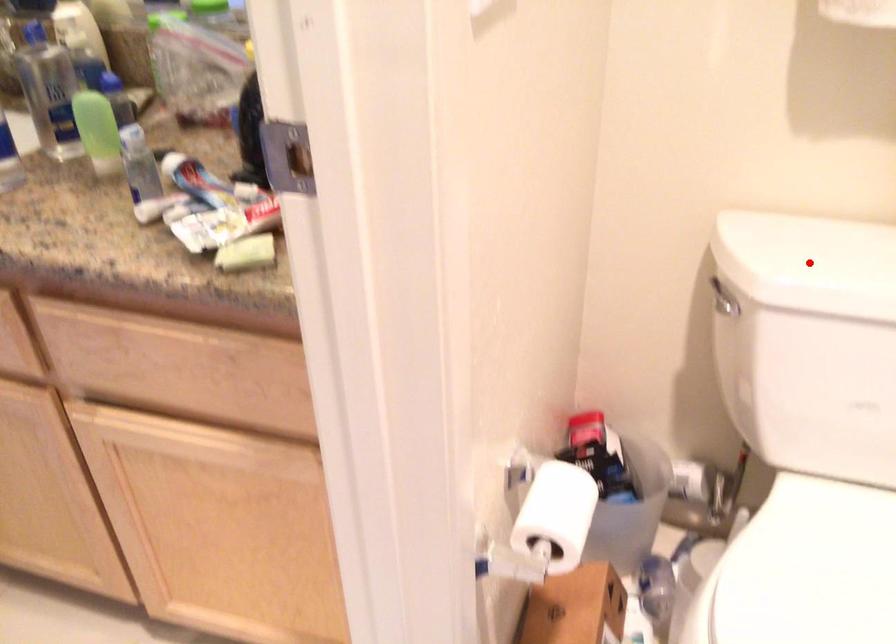
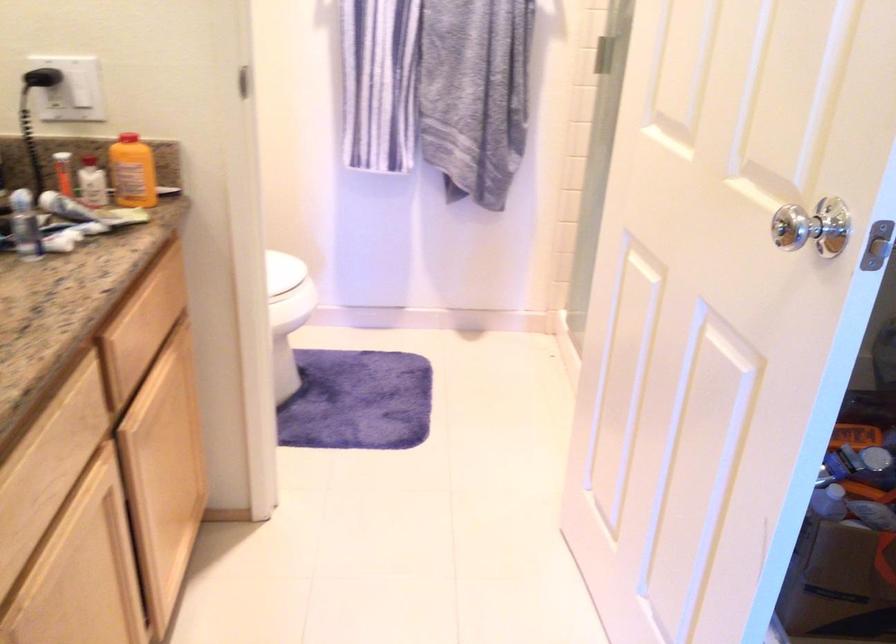
Question: I am providing you with two images of the same scene from different viewpoints. A red point is marked on the first image. Is the red point's position out of view in image 2?

Choices:
 (A) Yes
 (B) No

Answer: (A)